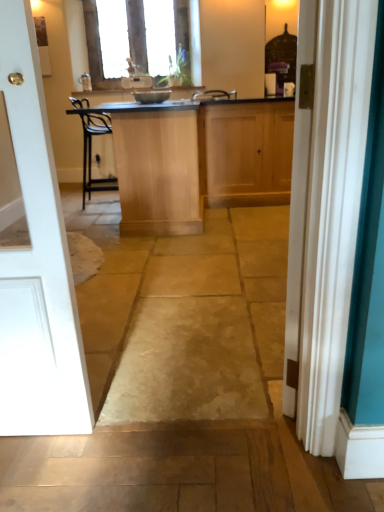
Describe the element at coordinates (152, 96) in the screenshot. I see `metallic silver bowl at center` at that location.

Locate an element on the screen. wooden cabinet at center, marked as the 2th cabinetry in a left-to-right arrangement is located at coordinates (245, 152).

At what (x,y) coordinates should I click in order to perform the action: click on teal fabric curtain at right. Please return your answer as a coordinate pair (x, y). This screenshot has height=512, width=384. Looking at the image, I should click on (333, 211).

The height and width of the screenshot is (512, 384). Identify the location of clear glass window at upper center. (95, 46).

Image resolution: width=384 pixels, height=512 pixels. Find the location of `light wood/finely finished cabinet at center, placed as the second cabinetry when sorted from right to left`. light wood/finely finished cabinet at center, placed as the second cabinetry when sorted from right to left is located at coordinates (157, 170).

Between natural stone floor at center and clear glass window at upper center, which one has larger width?

With larger width is natural stone floor at center.

Is point (165, 312) closer or farther from the camera than point (132, 9)?

Point (165, 312).

Is natural stone floor at center positioned with its back to clear glass window at upper center?

No, clear glass window at upper center is not at the back of natural stone floor at center.

In the scene shown: From a real-world perspective, which is physically below, natural stone floor at center or clear glass window at upper center?

natural stone floor at center.

Can you confirm if wooden cabinet at center, which is counted as the 1th cabinetry, starting from the right, is bigger than clear glass window at upper center?

Yes, wooden cabinet at center, which is counted as the 1th cabinetry, starting from the right, is bigger than clear glass window at upper center.

Is wooden cabinet at center, which is counted as the 1th cabinetry, starting from the right, wider or thinner than clear glass window at upper center?

Considering their sizes, wooden cabinet at center, which is counted as the 1th cabinetry, starting from the right, looks broader than clear glass window at upper center.

Can you tell me how much wooden cabinet at center, which is counted as the 1th cabinetry, starting from the right, and clear glass window at upper center differ in facing direction?

The angular difference between wooden cabinet at center, which is counted as the 1th cabinetry, starting from the right, and clear glass window at upper center is 1.17 degrees.

Is point (285, 125) in front of point (179, 6)?

Yes, it is in front of point (179, 6).

Is natural stone floor at center completely or partially inside wooden cabinet at center, which is counted as the 1th cabinetry, starting from the right?

No.

Is wooden cabinet at center, which is counted as the 1th cabinetry, starting from the right, facing towards natural stone floor at center?

No, wooden cabinet at center, which is counted as the 1th cabinetry, starting from the right, is not turned towards natural stone floor at center.

From the image's perspective, is wooden cabinet at center, marked as the 2th cabinetry in a left-to-right arrangement, above natural stone floor at center?

Yes.

Considering the relative sizes of wooden cabinet at center, which is counted as the 1th cabinetry, starting from the right, and natural stone floor at center in the image provided, is wooden cabinet at center, which is counted as the 1th cabinetry, starting from the right, smaller than natural stone floor at center?

Yes, wooden cabinet at center, which is counted as the 1th cabinetry, starting from the right, is smaller than natural stone floor at center.

Between white painted wood door at left and wooden cabinet at center, marked as the 2th cabinetry in a left-to-right arrangement, which one appears on the left side from the viewer's perspective?

white painted wood door at left is more to the left.

In the scene shown: Which point is more distant from viewer, [31,275] or [262,138]?

The point [262,138] is behind.

Is the surface of white painted wood door at left in direct contact with wooden cabinet at center, which is counted as the 1th cabinetry, starting from the right?

white painted wood door at left and wooden cabinet at center, which is counted as the 1th cabinetry, starting from the right, are clearly separated.

Considering the relative sizes of clear glass window at upper center and wooden cabinet at center, which is counted as the 1th cabinetry, starting from the right, in the image provided, is clear glass window at upper center wider than wooden cabinet at center, which is counted as the 1th cabinetry, starting from the right,?

No.

Do you think clear glass window at upper center is within wooden cabinet at center, which is counted as the 1th cabinetry, starting from the right, or outside of it?

clear glass window at upper center is located beyond the bounds of wooden cabinet at center, which is counted as the 1th cabinetry, starting from the right.

Which is nearer, (91, 42) or (288, 173)?

Clearly, point (91, 42) is more distant from the camera than point (288, 173).

Where is `window above the wooden cabinet at center, marked as the 2th cabinetry in a left-to-right arrangement (from a real-world perspective)`? window above the wooden cabinet at center, marked as the 2th cabinetry in a left-to-right arrangement (from a real-world perspective) is located at coordinates (95, 46).

Is clear glass window at upper center at the back of light wood/finely finished cabinet at center, the first cabinetry from the left?

That's not correct — light wood/finely finished cabinet at center, the first cabinetry from the left, is not looking away from clear glass window at upper center.

Considering the relative sizes of light wood/finely finished cabinet at center, placed as the second cabinetry when sorted from right to left, and clear glass window at upper center in the image provided, is light wood/finely finished cabinet at center, placed as the second cabinetry when sorted from right to left, wider than clear glass window at upper center?

Yes.

Is point (187, 200) farther from viewer compared to point (187, 3)?

No, it is in front of (187, 3).

Is wooden cabinet at center, which is counted as the 1th cabinetry, starting from the right, oriented away from white painted wood door at left?

No, wooden cabinet at center, which is counted as the 1th cabinetry, starting from the right, is not facing the opposite direction of white painted wood door at left.

In the image, is wooden cabinet at center, marked as the 2th cabinetry in a left-to-right arrangement, on the left side or the right side of white painted wood door at left?

In the image, wooden cabinet at center, marked as the 2th cabinetry in a left-to-right arrangement, appears on the right side of white painted wood door at left.

Considering the sizes of objects wooden cabinet at center, which is counted as the 1th cabinetry, starting from the right, and white painted wood door at left in the image provided, who is smaller, wooden cabinet at center, which is counted as the 1th cabinetry, starting from the right, or white painted wood door at left?

Smaller between the two is white painted wood door at left.

You are a GUI agent. You are given a task and a screenshot of the screen. Output one action in this format:
    pyautogui.click(x=<x>, y=<y>)
    Task: Click on the path lying in front of the clear glass window at upper center
    Image resolution: width=384 pixels, height=512 pixels.
    Given the screenshot: What is the action you would take?
    pyautogui.click(x=183, y=314)

Locate an element on the screen. Image resolution: width=384 pixels, height=512 pixels. window on the left of wooden cabinet at center, which is counted as the 1th cabinetry, starting from the right is located at coordinates pos(95,46).

Considering their positions, is metallic silver bowl at center positioned further to light wood/finely finished cabinet at center, the first cabinetry from the left, than teal fabric curtain at right?

Among the two, teal fabric curtain at right is located further to light wood/finely finished cabinet at center, the first cabinetry from the left.

Estimate the real-world distances between objects in this image. Which object is closer to natural stone floor at center, wooden cabinet at center, which is counted as the 1th cabinetry, starting from the right, or metallic silver bowl at center?

Based on the image, wooden cabinet at center, which is counted as the 1th cabinetry, starting from the right, appears to be nearer to natural stone floor at center.

Which object lies further to the anchor point natural stone floor at center, light wood/finely finished cabinet at center, the first cabinetry from the left, or metallic silver bowl at center?

metallic silver bowl at center is positioned further to the anchor natural stone floor at center.

Consider the image. Considering their positions, is white painted wood door at left positioned further to metallic silver bowl at center than wooden cabinet at center, marked as the 2th cabinetry in a left-to-right arrangement?

white painted wood door at left.

From the image, which object appears to be farther from white painted wood door at left, light wood/finely finished cabinet at center, placed as the second cabinetry when sorted from right to left, or teal fabric curtain at right?

Among the two, light wood/finely finished cabinet at center, placed as the second cabinetry when sorted from right to left, is located further to white painted wood door at left.

Based on their spatial positions, is metallic silver bowl at center or natural stone floor at center closer to light wood/finely finished cabinet at center, the first cabinetry from the left?

Based on the image, natural stone floor at center appears to be nearer to light wood/finely finished cabinet at center, the first cabinetry from the left.

When comparing their distances from clear glass window at upper center, does light wood/finely finished cabinet at center, placed as the second cabinetry when sorted from right to left, or teal fabric curtain at right seem further?

Among the two, teal fabric curtain at right is located further to clear glass window at upper center.

Considering their positions, is natural stone floor at center positioned closer to metallic silver bowl at center than white painted wood door at left?

The object closer to metallic silver bowl at center is natural stone floor at center.

Locate an element on the screen. Image resolution: width=384 pixels, height=512 pixels. path between white painted wood door at left and metallic silver bowl at center in the front-back direction is located at coordinates (183, 314).

This screenshot has height=512, width=384. I want to click on door located between teal fabric curtain at right and light wood/finely finished cabinet at center, the first cabinetry from the left, in the depth direction, so click(x=37, y=263).

At what (x,y) coordinates should I click in order to perform the action: click on door between teal fabric curtain at right and wooden cabinet at center, which is counted as the 1th cabinetry, starting from the right, in the front-back direction. Please return your answer as a coordinate pair (x, y). This screenshot has height=512, width=384. Looking at the image, I should click on (x=37, y=263).

Where is `appliance positioned between white painted wood door at left and clear glass window at upper center from near to far`? appliance positioned between white painted wood door at left and clear glass window at upper center from near to far is located at coordinates tap(152, 96).